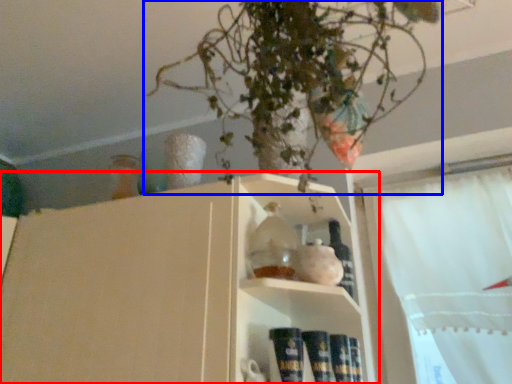
Question: Which object is further to the camera taking this photo, shelf (highlighted by a red box) or houseplant (highlighted by a blue box)?

Choices:
 (A) shelf
 (B) houseplant

Answer: (B)